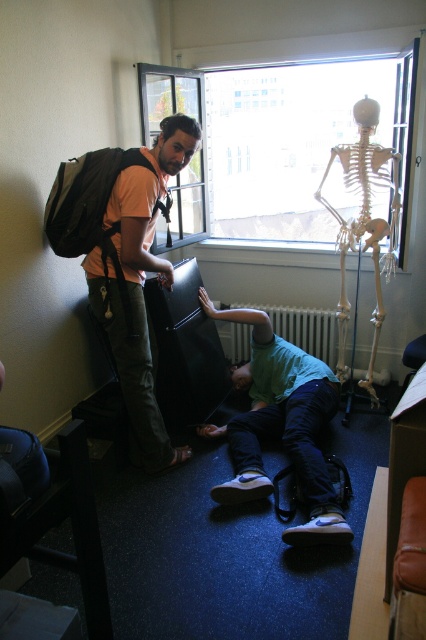
Question: Does matte orange t-shirt at upper left appear on the left side of white metallic radiator at center?

Choices:
 (A) yes
 (B) no

Answer: (A)

Question: Which point is farther to the camera?

Choices:
 (A) (253, 404)
 (B) (131, 376)
 (C) (298, 308)

Answer: (C)

Question: Estimate the real-world distances between objects in this image. Which object is farther from the transparent glass window at upper center?

Choices:
 (A) white metallic radiator at center
 (B) green matte shirt at lower center
 (C) matte orange t-shirt at upper left

Answer: (C)

Question: Which point appears farthest from the camera in this image?

Choices:
 (A) (146, 426)
 (B) (264, 236)
 (C) (304, 333)
 (D) (264, 470)

Answer: (B)

Question: Does transparent glass window at upper center have a greater width compared to matte orange t-shirt at upper left?

Choices:
 (A) yes
 (B) no

Answer: (A)

Question: Does transparent glass window at upper center come in front of white metallic radiator at center?

Choices:
 (A) yes
 (B) no

Answer: (A)